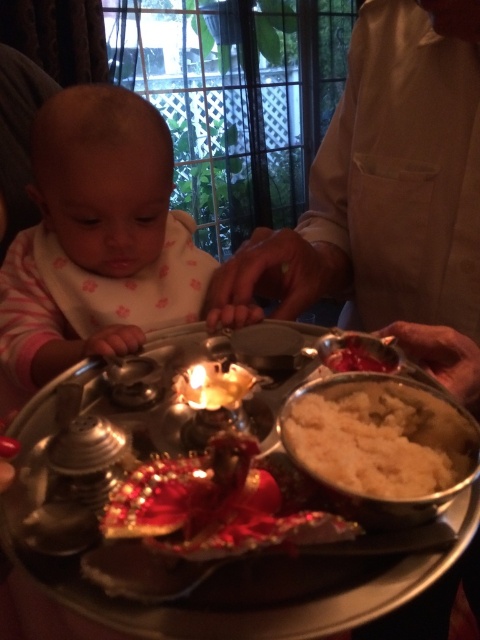
You are an event planner setting up for a baby naming ceremony. You have two items on the table in front of you, the light beige fabric at center and the matte white bib at left. The baby will be sitting between them. Which item will be closer to the baby?

The light beige fabric at center is much taller than the matte white bib at left, so it will be closer to the baby.

You are a photographer standing 20 inches away from the light beige fabric at center. Can you reach it without moving your feet?

The light beige fabric at center is 18.76 inches away from the viewer, so yes, you can reach it without moving your feet since it is within your arm length.